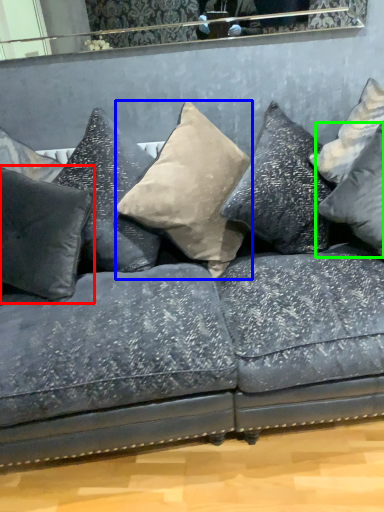
Question: Considering the real-world distances, which object is farthest from pillow (highlighted by a red box)? pillow (highlighted by a blue box) or pillow (highlighted by a green box)?

Choices:
 (A) pillow
 (B) pillow

Answer: (B)